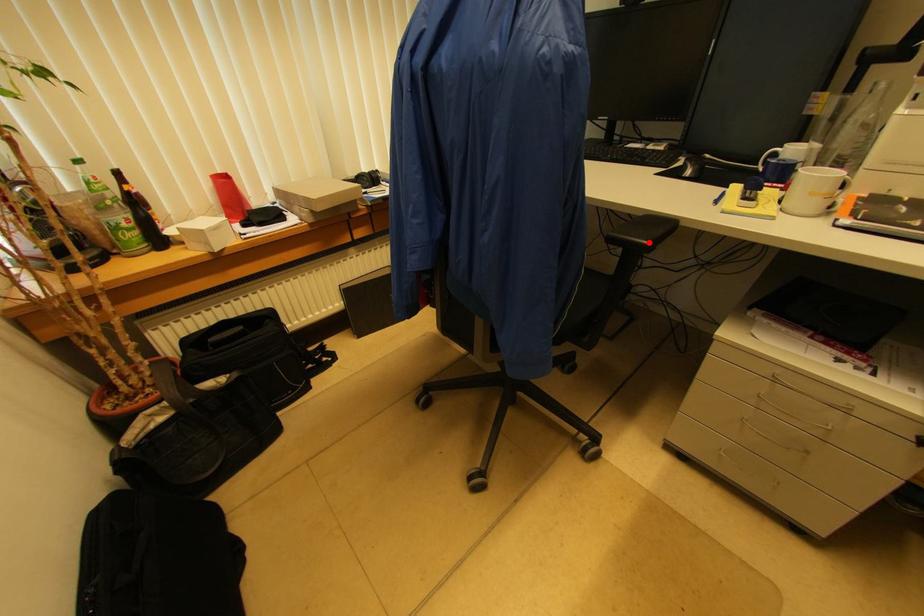
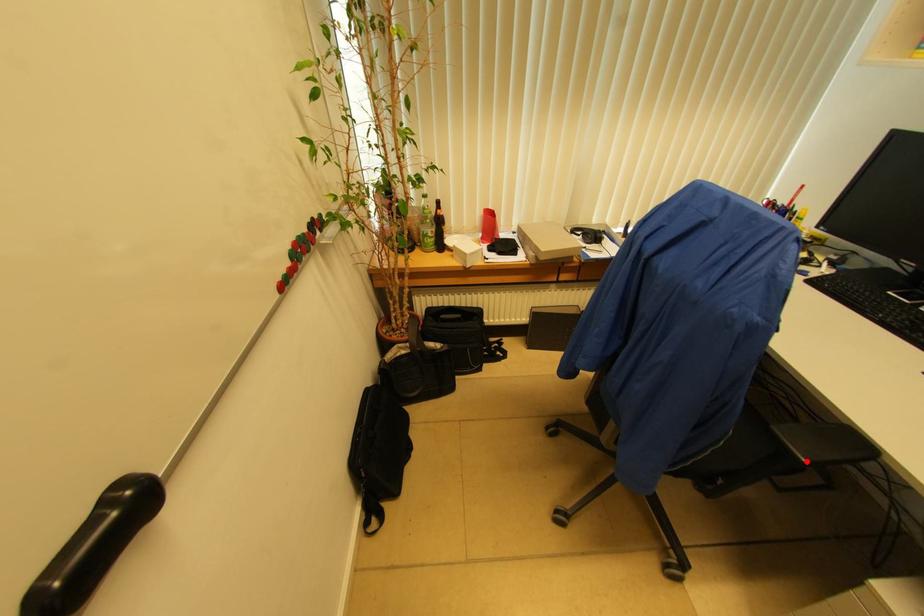
I am providing you with two images of the same scene from different viewpoints. A red point is marked on the first image and another point is marked on the second image. Is the marked point in image1 the same physical position as the marked point in image2?

Yes